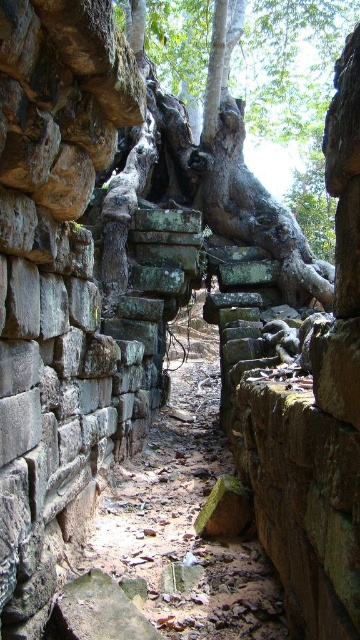
Does brown stone path at center have a lesser height compared to green rough bark tree at center?

Indeed, brown stone path at center has a lesser height compared to green rough bark tree at center.

Who is shorter, brown stone path at center or green rough bark tree at center?

brown stone path at center is shorter.

Between point (209, 358) and point (171, 108), which one is positioned behind?

Positioned behind is point (209, 358).

You are a GUI agent. You are given a task and a screenshot of the screen. Output one action in this format:
    pyautogui.click(x=<x>, y=<y>)
    Task: Click on the brown stone path at center
    Image resolution: width=360 pixels, height=640 pixels.
    Given the screenshot: What is the action you would take?
    pyautogui.click(x=185, y=525)